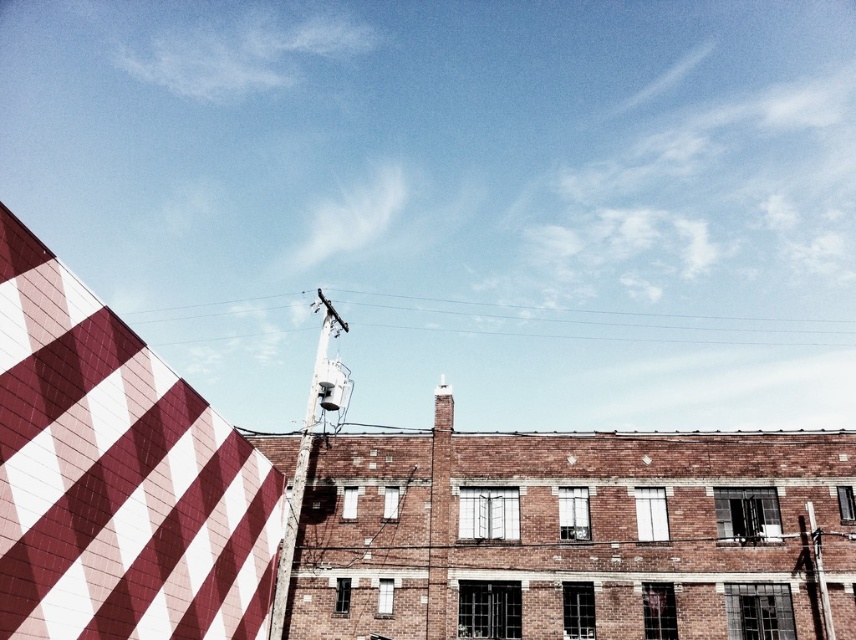
Question: Can you confirm if metallic pole at center is positioned above metallic pole at right?

Choices:
 (A) no
 (B) yes

Answer: (B)

Question: Can you confirm if diagonal striped fabric at upper left is positioned above metallic pole at center?

Choices:
 (A) no
 (B) yes

Answer: (A)

Question: Which point is farther from the camera taking this photo?

Choices:
 (A) (290, 566)
 (B) (812, 524)

Answer: (B)

Question: Which point is closer to the camera?

Choices:
 (A) metallic pole at center
 (B) metallic pole at right

Answer: (A)

Question: Which point is closer to the camera taking this photo?

Choices:
 (A) (314, 397)
 (B) (825, 616)
 (C) (62, 346)

Answer: (C)

Question: Does diagonal striped fabric at upper left have a lesser width compared to metallic pole at right?

Choices:
 (A) no
 (B) yes

Answer: (A)